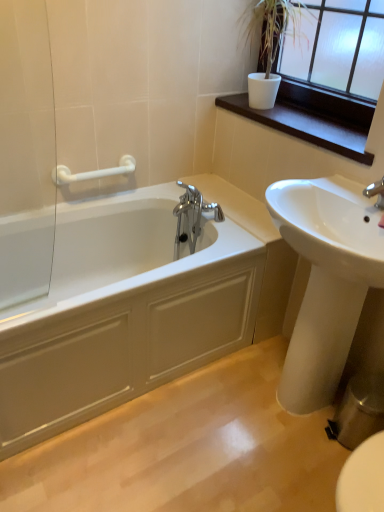
Locate an element on the screen. This screenshot has width=384, height=512. free space that is to the left of white glossy sink at lower right is located at coordinates (191, 428).